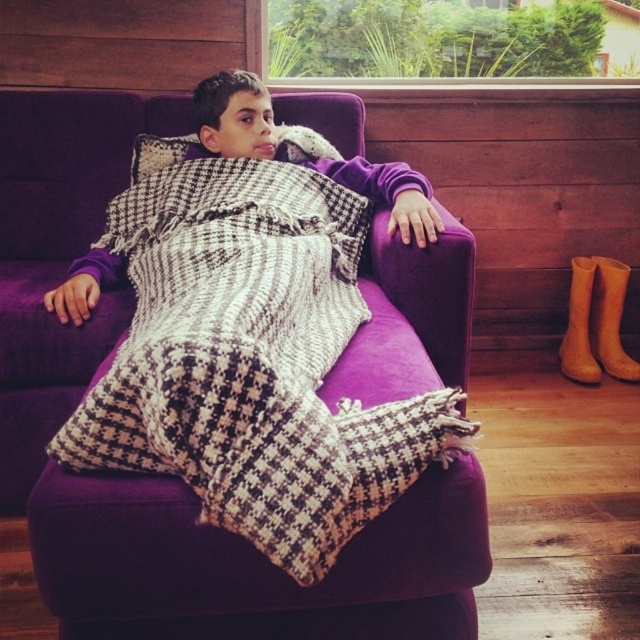
You are designing a shoe organizer that needs to accommodate both the brown suede boot at lower right and the brown leather boot at right. Which boot requires a wider compartment?

The brown suede boot at lower right requires a wider compartment because its width is larger than the brown leather boot at right.

You are standing in the room and want to place a small plant pot on the purple fabric armchair at center. However, there is a brown suede boot at lower right in the way. Based on their positions, can you directly place the plant pot on the armchair without moving the boot?

The purple fabric armchair at center is located below the brown suede boot at lower right, so the boot is above the armchair. Since the boot is not blocking the armchair directly, you can place the plant pot on the armchair without moving the boot.

You are trying to decide which brown boot to wear today. You have the brown suede boot at lower right and the brown leather boot at right. Which one has a larger size?

The brown suede boot at lower right is bigger than the brown leather boot at right, so it has a larger size.